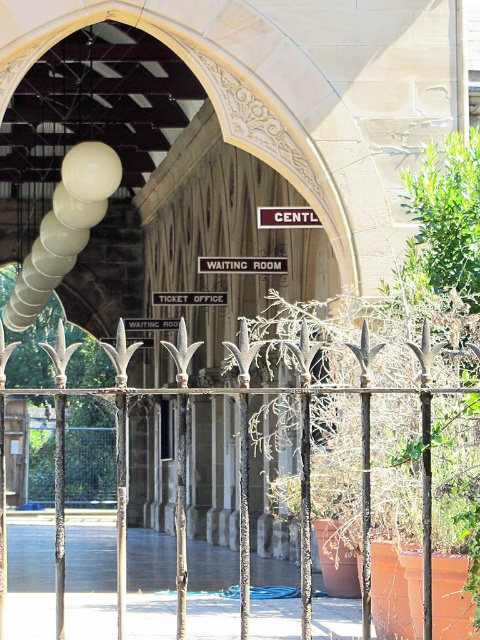
You are standing in front of the ornate arched gateway of a historic building. You notice a rusty iron fence at center. Based on its position, can you estimate where exactly it is located relative to the gateway entrance?

The rusty iron fence at center is located at the point 0.887 along the horizontal axis and 0.190 along the vertical axis, which places it near the lower central part of the gateway entrance.

You are standing in front of the gateway and want to read the signs. Which sign, the brown wood sign at center or the white plastic sign at center, is positioned higher?

The brown wood sign at center is located above the white plastic sign at center, so it is positioned higher.

You are a visitor approaching the entrance of the historic building. You see the rusty iron fence at center and the black metal sign at center. Which object is closer to the entrance?

The rusty iron fence at center is to the left of the black metal sign at center, so the rusty iron fence at center is closer to the entrance.